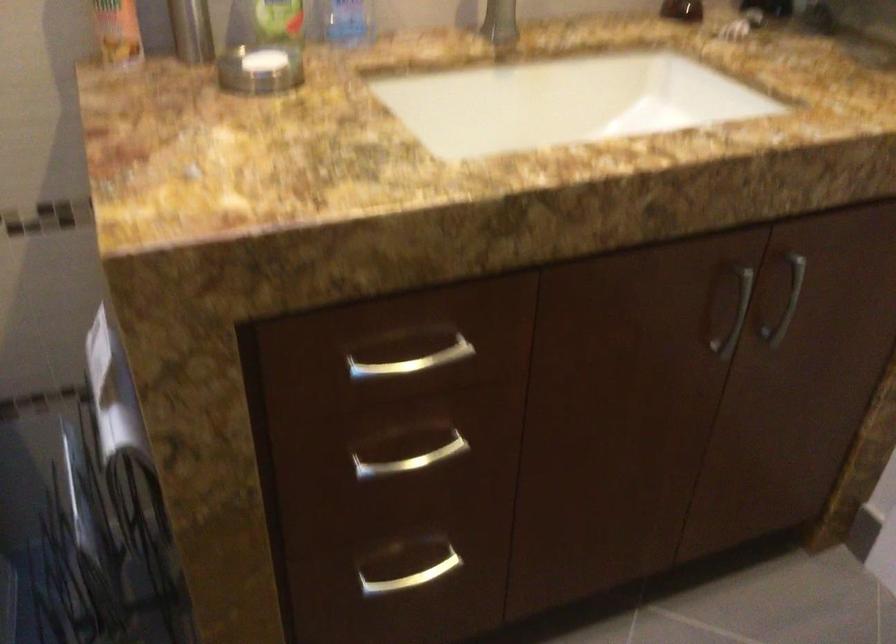
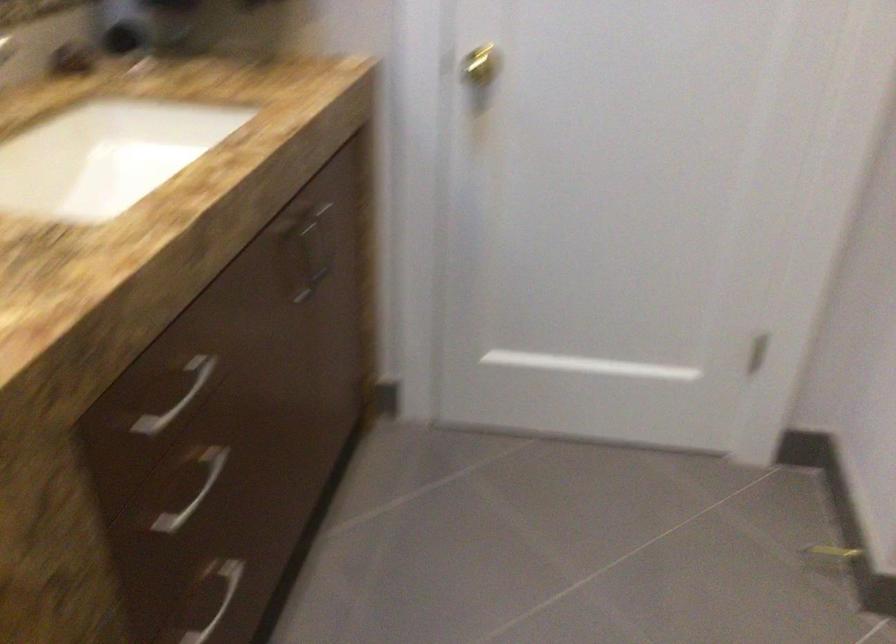
The point at (416, 451) is marked in the first image. Where is the corresponding point in the second image?

(187, 488)